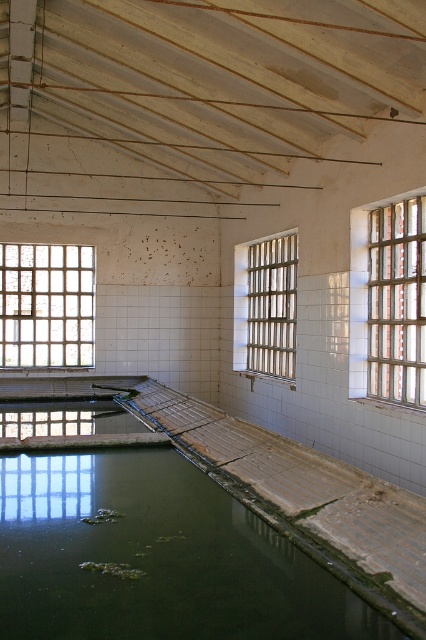
You are a maintenance worker checking the condition of the pool area. You notice the green algae at lower left and the metallic bars at center. Based on their positions, which object is closer to the light source coming through the windows?

The metallic bars at center are closer to the light source because the green algae at lower left might be wider than metallic bars at center, implying the bars cast a shadow that affects the algae area.

You are a maintenance worker inspecting the old indoor pool. You need to locate the green algae at lower left. According to the coordinates provided, where exactly should you look?

The green algae at lower left is located at the coordinates point [155,557].

You are standing in the old indoor pool and want to exit through the nearest window. Which window should you go to, the clear glass window at right or the clear glass window at left?

You should go to the clear glass window at left because it is closer to your current position when facing the windows. Since the clear glass window at right is to the right of the clear glass window at left, the left window would be nearest to you if you are facing them.